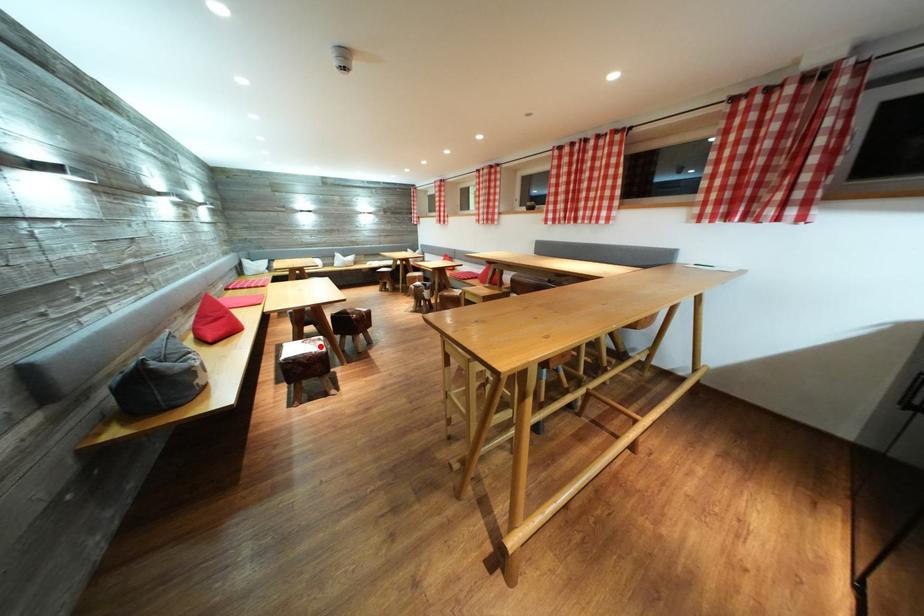
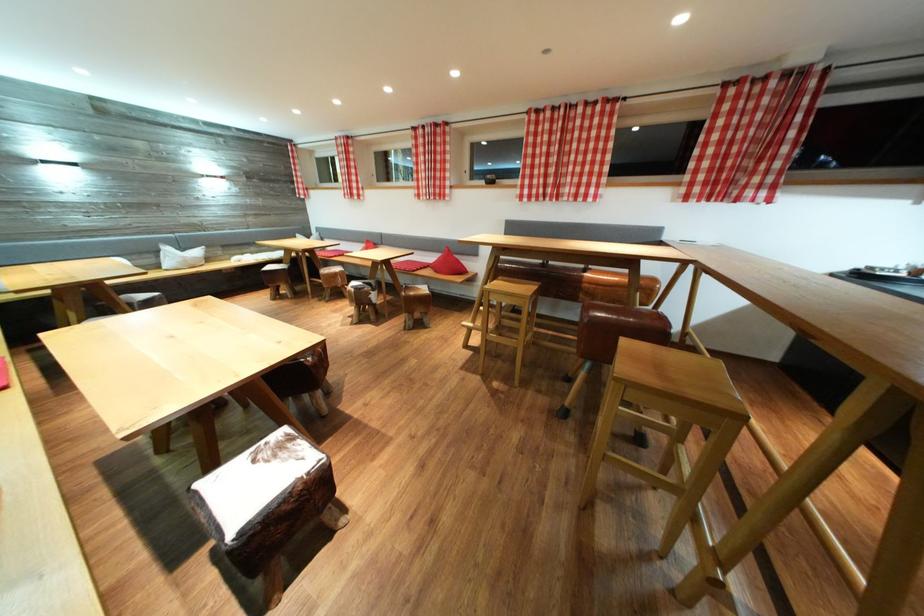
Find the pixel in the second image that matches the highlighted location in the first image.

(286, 452)